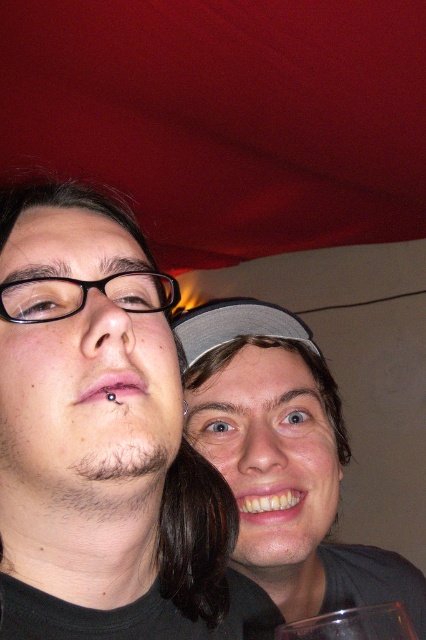
You are taking a photo of two people at an event. The first person is at point (157, 432) and the second is at point (175, 328). Which person should you focus on if you want the one closer to the camera to be in sharp focus?

You should focus on point (157, 432) because it is closer to the camera than point (175, 328), so focusing there will ensure the person at that position is in sharp focus.

You are a photographer setting up for a group photo. You need to ensure that the two subjects, the matte black hair at upper left and the matte gray cap at center, are positioned within a 6.5 inch frame. Can both subjects fit within the frame if you center them?

The distance between the matte black hair at upper left and the matte gray cap at center is 6.46 inches, which is less than the 6.5 inch frame. Therefore, both subjects can fit within the frame when centered.

You are standing in the room and want to touch the matte black hair at upper left and the matte gray cap at center. Which object can you reach first without moving your position?

Result: The matte black hair at upper left is closer to the viewer than the matte gray cap at center, so you can reach the matte black hair at upper left first without moving your position.